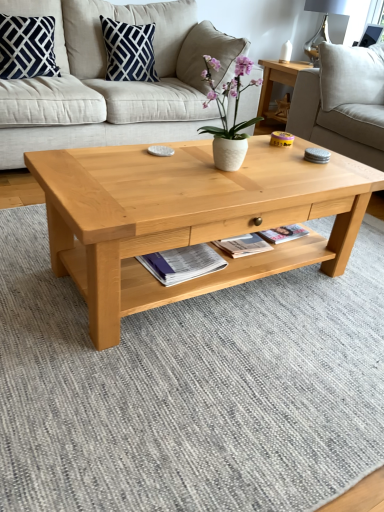
At what (x,y) coordinates should I click in order to perform the action: click on free space that is to the left of white ceramic vase at center. Please return your answer as a coordinate pair (x, y). Looking at the image, I should click on coord(168,169).